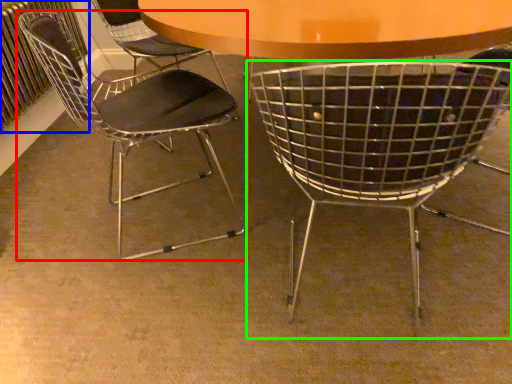
Question: Which is farther away from chair (highlighted by a red box)? radiator (highlighted by a blue box) or chair (highlighted by a green box)?

Choices:
 (A) radiator
 (B) chair

Answer: (B)